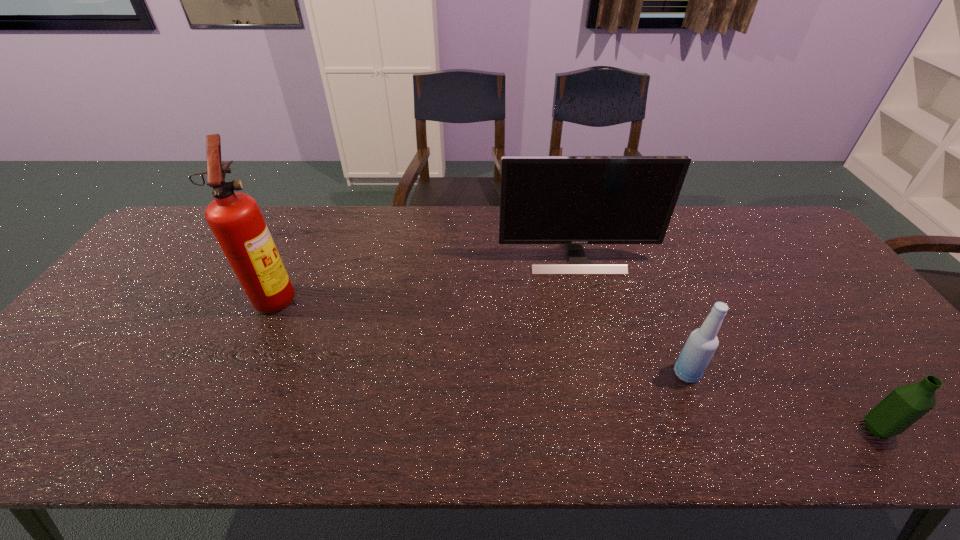
Image resolution: width=960 pixels, height=540 pixels. Find the location of `free space that satisfies the following two spatial constraints: 1. on the front-facing side of the tallest object; 2. on the left side of the shortest object`. free space that satisfies the following two spatial constraints: 1. on the front-facing side of the tallest object; 2. on the left side of the shortest object is located at coordinates (212, 429).

In order to click on free point that satisfies the following two spatial constraints: 1. on the front side of the second shortest object; 2. on the right side of the shortest object in this screenshot , I will do `click(709, 429)`.

I want to click on vacant point that satisfies the following two spatial constraints: 1. on the front-facing side of the fire extinguisher; 2. on the right side of the second nearest object, so click(x=239, y=374).

You are a GUI agent. You are given a task and a screenshot of the screen. Output one action in this format:
    pyautogui.click(x=<x>, y=<y>)
    Task: Click on the free space in the image that satisfies the following two spatial constraints: 1. on the front-facing side of the fire extinguisher; 2. on the back side of the shortest object
    The width and height of the screenshot is (960, 540).
    Given the screenshot: What is the action you would take?
    pyautogui.click(x=212, y=429)

Locate an element on the screen. The image size is (960, 540). vacant space that satisfies the following two spatial constraints: 1. on the screen side of the monitor; 2. on the left side of the rightmost object is located at coordinates (618, 429).

The image size is (960, 540). I want to click on free space that satisfies the following two spatial constraints: 1. on the front-facing side of the bottle; 2. on the left side of the tallest object, so click(239, 374).

You are a GUI agent. You are given a task and a screenshot of the screen. Output one action in this format:
    pyautogui.click(x=<x>, y=<y>)
    Task: Click on the vacant region that satisfies the following two spatial constraints: 1. on the screen side of the second tallest object; 2. on the right side of the bottle
    
    Given the screenshot: What is the action you would take?
    pyautogui.click(x=604, y=374)